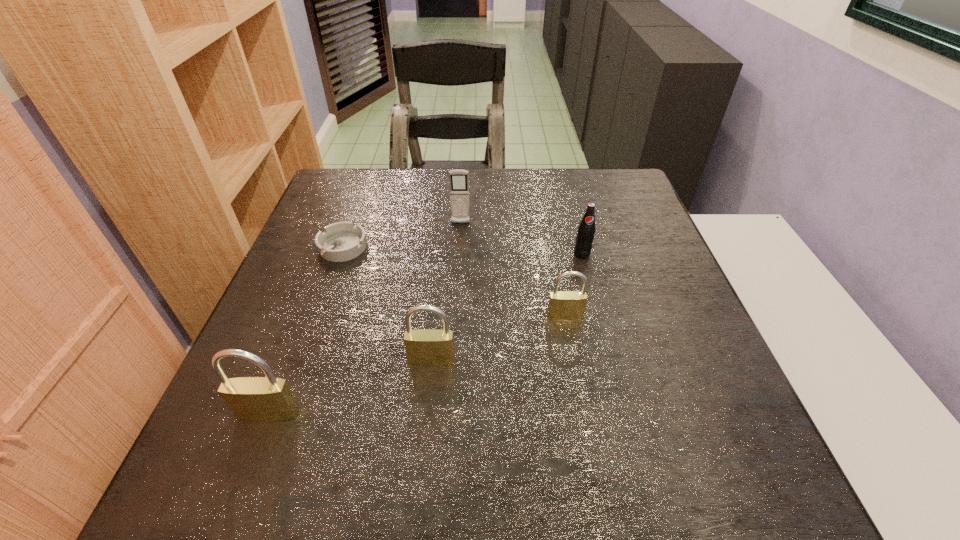
Where is `free space at the left edge`? Image resolution: width=960 pixels, height=540 pixels. free space at the left edge is located at coordinates (278, 336).

You are a GUI agent. You are given a task and a screenshot of the screen. Output one action in this format:
    pyautogui.click(x=<x>, y=<y>)
    Task: Click on the vacant space at the right edge
    
    Given the screenshot: What is the action you would take?
    pyautogui.click(x=612, y=270)

In the image, there is a desktop. Identify the location of vacant space at the far left corner. The width and height of the screenshot is (960, 540). (362, 191).

Where is `free area in between the second farthest padlock and the shortest object`? The width and height of the screenshot is (960, 540). free area in between the second farthest padlock and the shortest object is located at coordinates (387, 304).

This screenshot has height=540, width=960. Find the location of `empty space between the ashtray and the leftmost padlock`. empty space between the ashtray and the leftmost padlock is located at coordinates (305, 331).

Find the location of a particular element. The image size is (960, 540). vacant space that's between the nearest padlock and the farthest object is located at coordinates point(365,319).

I want to click on free spot between the fourth farthest object and the ashtray, so click(454, 282).

At what (x,y) coordinates should I click in order to perform the action: click on vacant space in between the ashtray and the rightmost object. Please return your answer as a coordinate pair (x, y). Looking at the image, I should click on (462, 251).

This screenshot has width=960, height=540. Identify the location of free spot between the cellular telephone and the leftmost padlock. 365,319.

Find the location of a particular element. free spot between the farthest object and the ashtray is located at coordinates (401, 236).